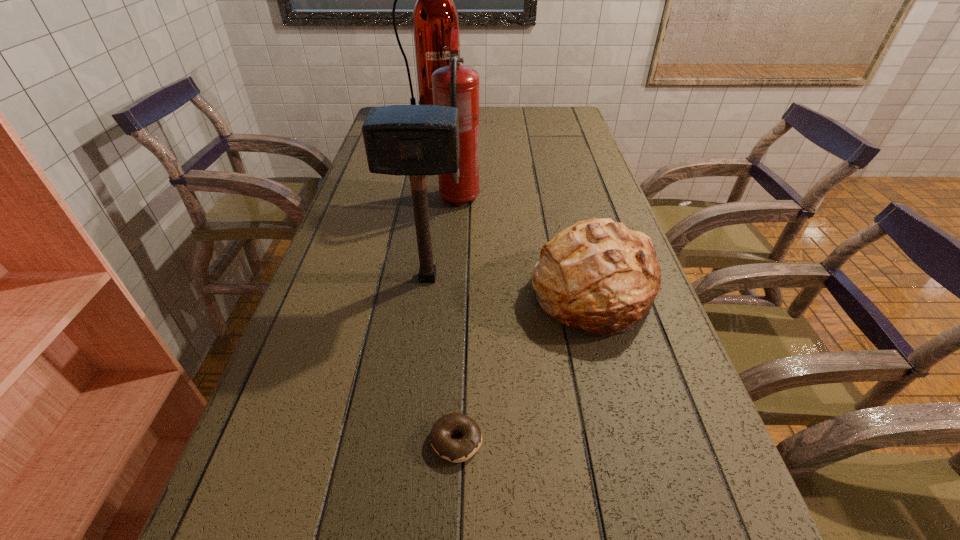
Where is `vacant region at the far edge of the desktop`? The height and width of the screenshot is (540, 960). vacant region at the far edge of the desktop is located at coordinates (536, 126).

Find the location of a particular element. vacant region at the left edge is located at coordinates 282,468.

Identify the location of vacant space at the right edge. (690, 464).

What are the coordinates of `free spot between the mallet and the taller fire extinguisher` in the screenshot? It's located at (430, 197).

Locate an element on the screen. This screenshot has height=540, width=960. vacant area that lies between the mallet and the shortest object is located at coordinates (443, 359).

Image resolution: width=960 pixels, height=540 pixels. I want to click on free space between the farther fire extinguisher and the shortest object, so click(x=444, y=279).

The image size is (960, 540). Identify the location of free space between the rightmost object and the shortest object. (524, 366).

The image size is (960, 540). Find the location of `vacant space that is in between the second shortest object and the shorter fire extinguisher`. vacant space that is in between the second shortest object and the shorter fire extinguisher is located at coordinates coord(526,246).

Locate an element on the screen. vacant area between the mallet and the second farthest object is located at coordinates (444, 238).

Where is `free area in between the farther fire extinguisher and the shortest object`? The height and width of the screenshot is (540, 960). free area in between the farther fire extinguisher and the shortest object is located at coordinates (444, 279).